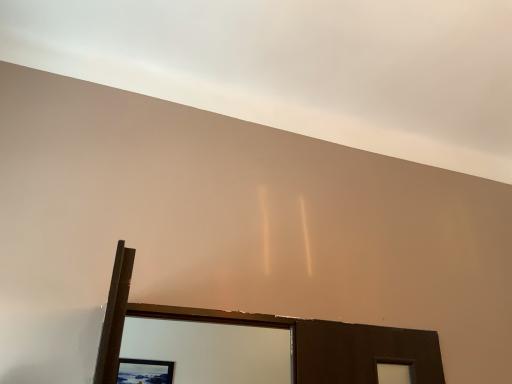
Question: Is the depth of wooden picture frame at lower center less than that of white matte ceiling at upper center?

Choices:
 (A) yes
 (B) no

Answer: (B)

Question: Is wooden picture frame at lower center looking in the opposite direction of white matte ceiling at upper center?

Choices:
 (A) yes
 (B) no

Answer: (B)

Question: Can you confirm if wooden picture frame at lower center is wider than white matte ceiling at upper center?

Choices:
 (A) no
 (B) yes

Answer: (A)

Question: Considering the relative sizes of wooden picture frame at lower center and white matte ceiling at upper center in the image provided, is wooden picture frame at lower center shorter than white matte ceiling at upper center?

Choices:
 (A) no
 (B) yes

Answer: (A)

Question: Can you confirm if wooden picture frame at lower center is thinner than white matte ceiling at upper center?

Choices:
 (A) yes
 (B) no

Answer: (A)

Question: Is white matte ceiling at upper center inside wooden picture frame at lower center?

Choices:
 (A) no
 (B) yes

Answer: (A)

Question: Can you confirm if white matte ceiling at upper center is smaller than wooden picture frame at lower center?

Choices:
 (A) no
 (B) yes

Answer: (A)

Question: Considering the relative sizes of white matte ceiling at upper center and wooden picture frame at lower center in the image provided, is white matte ceiling at upper center bigger than wooden picture frame at lower center?

Choices:
 (A) no
 (B) yes

Answer: (B)

Question: From a real-world perspective, is white matte ceiling at upper center physically below wooden picture frame at lower center?

Choices:
 (A) yes
 (B) no

Answer: (B)

Question: Could wooden picture frame at lower center be considered to be inside white matte ceiling at upper center?

Choices:
 (A) yes
 (B) no

Answer: (B)

Question: Can you confirm if white matte ceiling at upper center is positioned to the right of wooden picture frame at lower center?

Choices:
 (A) yes
 (B) no

Answer: (A)

Question: Is white matte ceiling at upper center closer to camera compared to wooden picture frame at lower center?

Choices:
 (A) no
 (B) yes

Answer: (B)

Question: Considering the positions of white matte ceiling at upper center and wooden picture frame at lower center in the image, is white matte ceiling at upper center wider or thinner than wooden picture frame at lower center?

Choices:
 (A) wide
 (B) thin

Answer: (A)